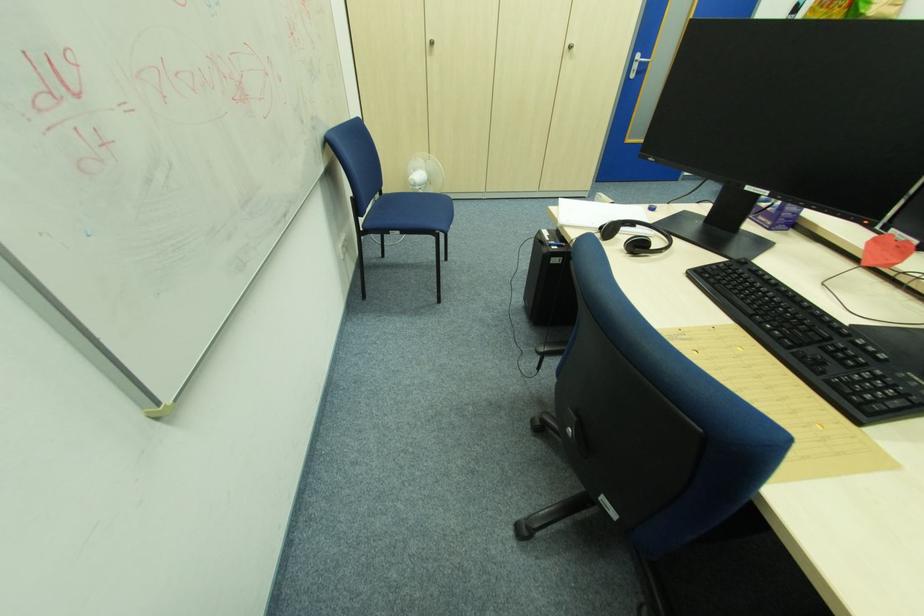
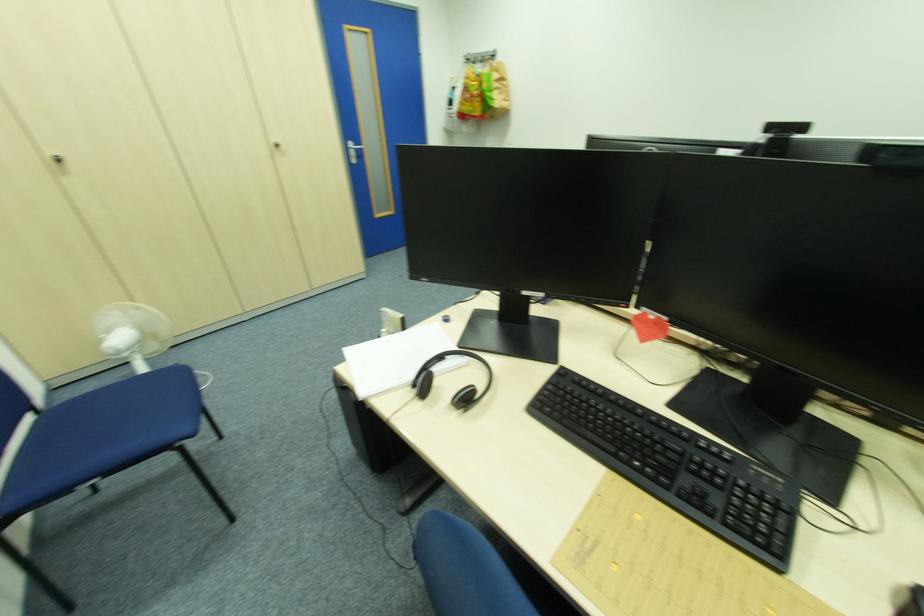
Where in the second image is the point corresponding to point 641,227 from the first image?

(454, 359)